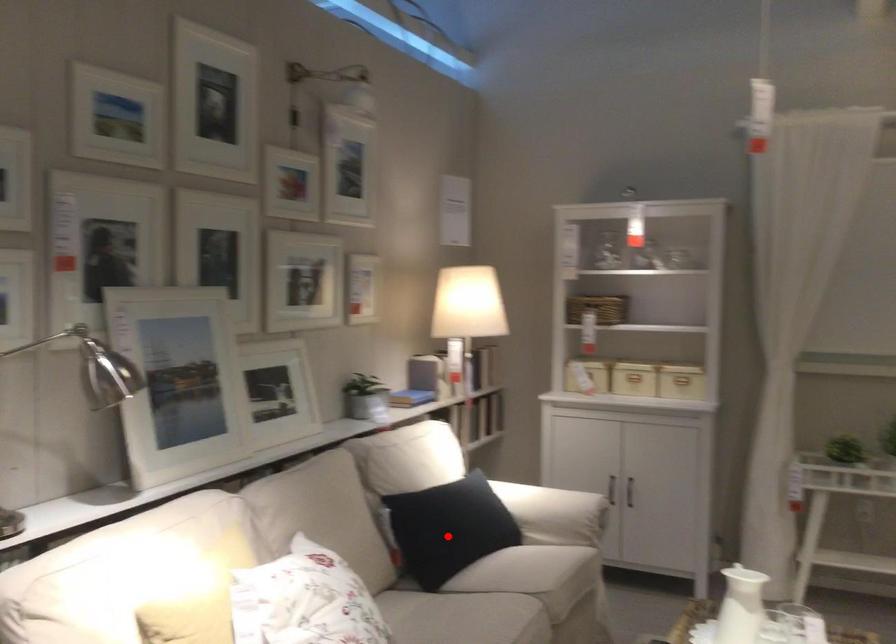
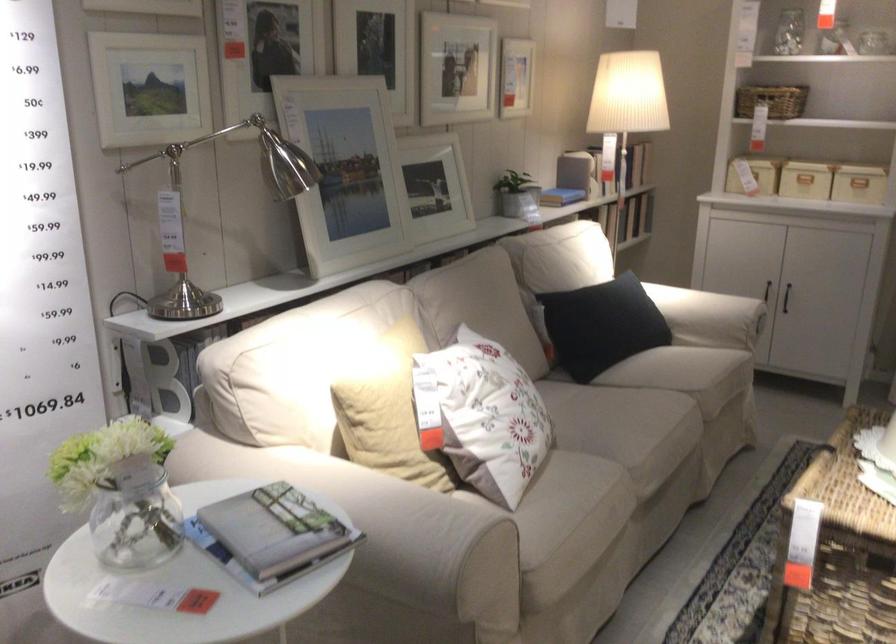
Where in the second image is the point corresponding to the highlighted location from the first image?

(600, 325)